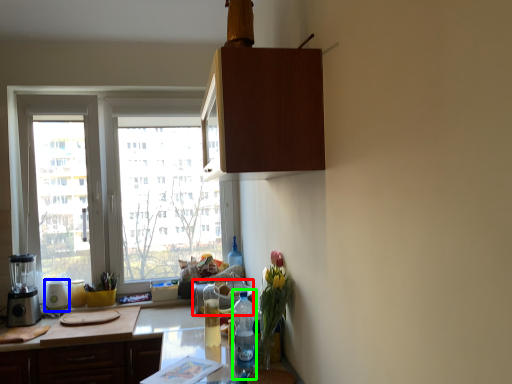
Question: Estimate the real-world distances between objects in this image. Which object is closer to appliance (highlighted by a red box), appliance (highlighted by a blue box) or bottle (highlighted by a green box)?

Choices:
 (A) appliance
 (B) bottle

Answer: (B)